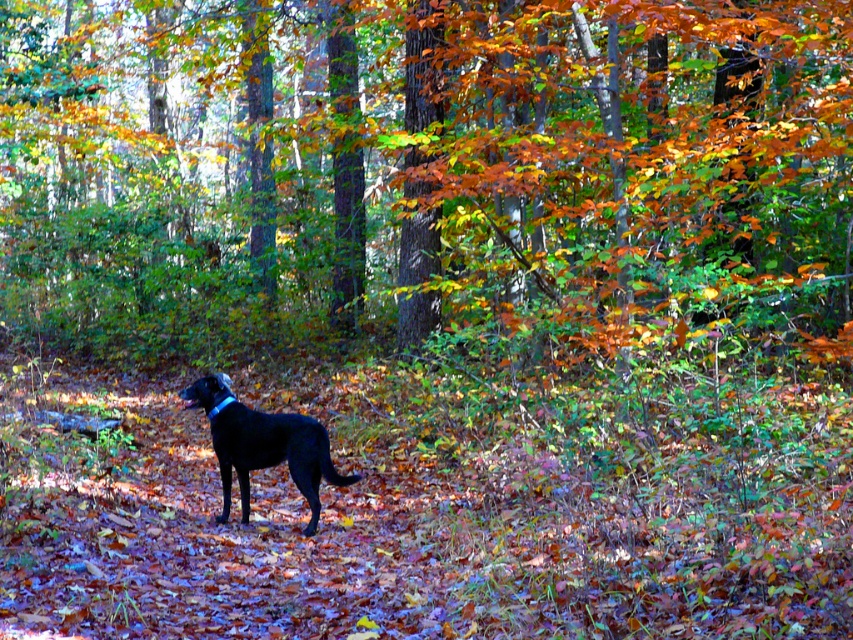
Question: Among these objects, which one is nearest to the camera?

Choices:
 (A) blue fabric neckband at center
 (B) shiny black dog at center

Answer: (B)

Question: Can you confirm if shiny black dog at center is smaller than blue fabric neckband at center?

Choices:
 (A) no
 (B) yes

Answer: (A)

Question: Which point is farther to the camera?

Choices:
 (A) (218, 412)
 (B) (198, 388)

Answer: (B)

Question: Can you confirm if shiny black dog at center is wider than blue fabric neckband at center?

Choices:
 (A) no
 (B) yes

Answer: (B)

Question: Can you confirm if shiny black dog at center is positioned below blue fabric neckband at center?

Choices:
 (A) no
 (B) yes

Answer: (B)

Question: Which of the following is the farthest from the observer?

Choices:
 (A) blue fabric neckband at center
 (B) shiny black dog at center

Answer: (A)